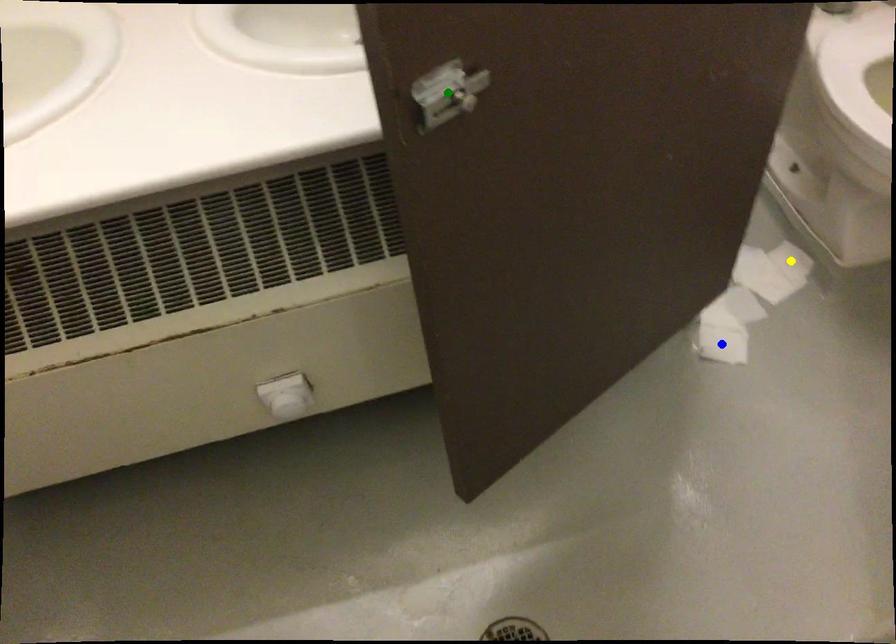
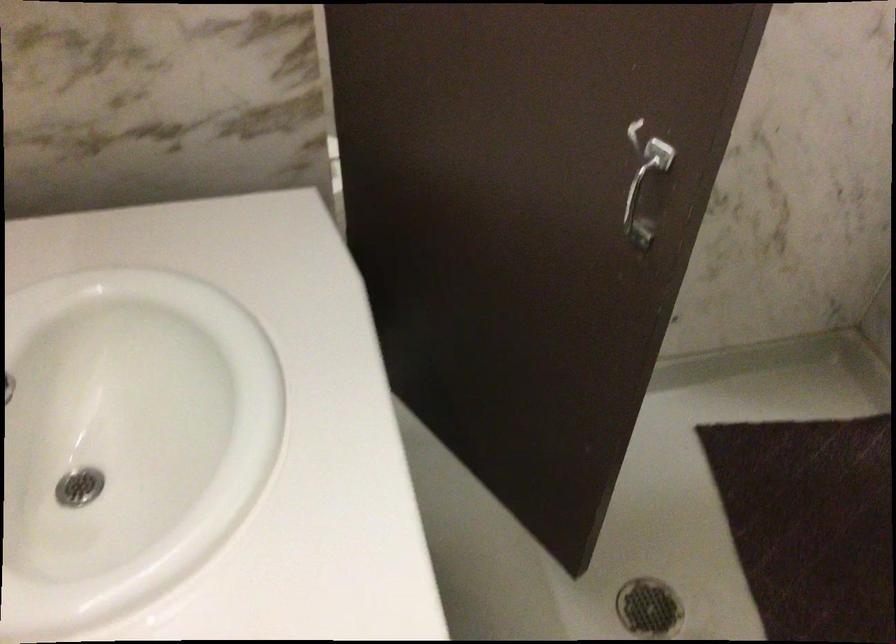
I am providing you with two images of the same scene from different viewpoints. Three points are marked in image1. Which point corresponds to a part or object that is occluded in image2?In image1, three points are marked. Which of them correspond to a part or object that is occluded in image2?Among the three points shown in image1, which one corresponds to a part or object that is no longer visible due to occlusion in image2?

yellow point, green point, blue point cannot be seen in image2.